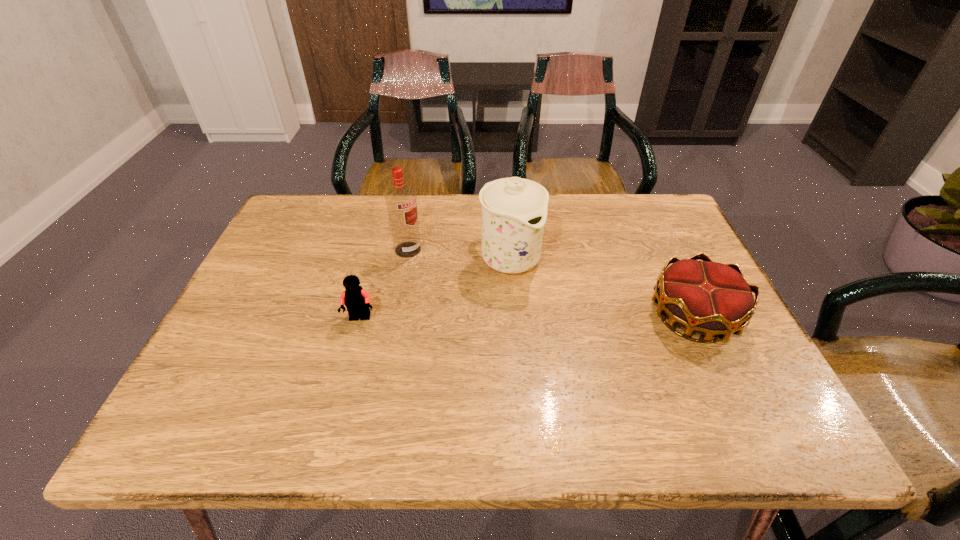
This screenshot has height=540, width=960. Find the location of `vacant space situated 0.120m on the spout of the chinaware`. vacant space situated 0.120m on the spout of the chinaware is located at coordinates (558, 313).

Locate an element on the screen. The height and width of the screenshot is (540, 960). vacant space situated 0.290m on the spout of the chinaware is located at coordinates (608, 364).

This screenshot has height=540, width=960. Identify the location of vodka situated at the far edge. coord(401,202).

You are a GUI agent. You are given a task and a screenshot of the screen. Output one action in this format:
    pyautogui.click(x=<x>, y=<y>)
    Task: Click on the chinaware at the far edge
    This screenshot has width=960, height=540.
    Given the screenshot: What is the action you would take?
    pyautogui.click(x=514, y=210)

The width and height of the screenshot is (960, 540). Find the location of `object that is at the right edge`. object that is at the right edge is located at coordinates (709, 298).

In the image, there is a desktop. Where is `free region at the far edge`? free region at the far edge is located at coordinates (449, 214).

This screenshot has width=960, height=540. What are the coordinates of `vacant space at the near edge of the desktop` in the screenshot? It's located at (473, 397).

You are a GUI agent. You are given a task and a screenshot of the screen. Output one action in this format:
    pyautogui.click(x=<x>, y=<y>)
    Task: Click on the vacant space at the left edge of the desktop
    The height and width of the screenshot is (540, 960).
    Given the screenshot: What is the action you would take?
    pyautogui.click(x=245, y=286)

The width and height of the screenshot is (960, 540). In the image, there is a desktop. What are the coordinates of `vacant space at the far left corner` in the screenshot? It's located at (312, 207).

I want to click on vacant area at the far right corner, so click(x=626, y=200).